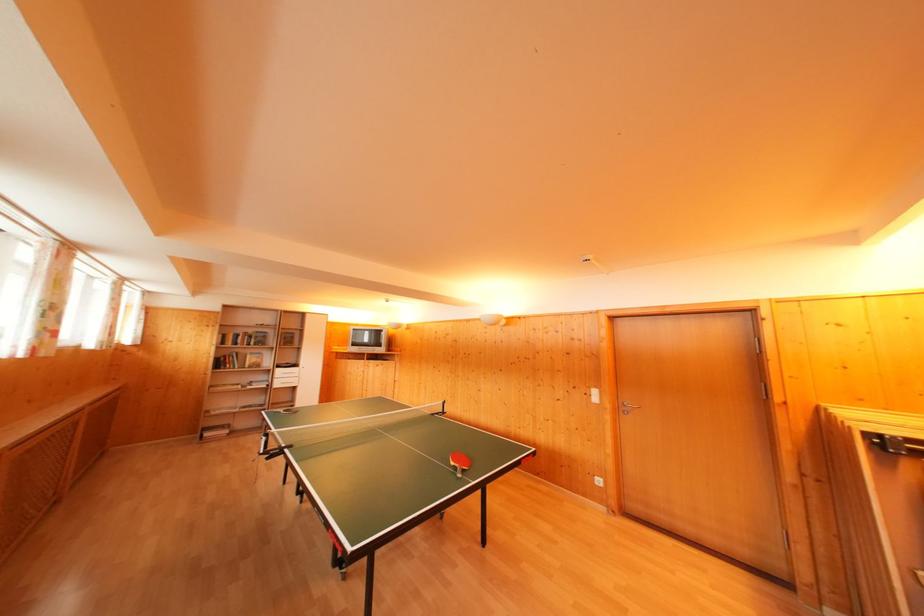
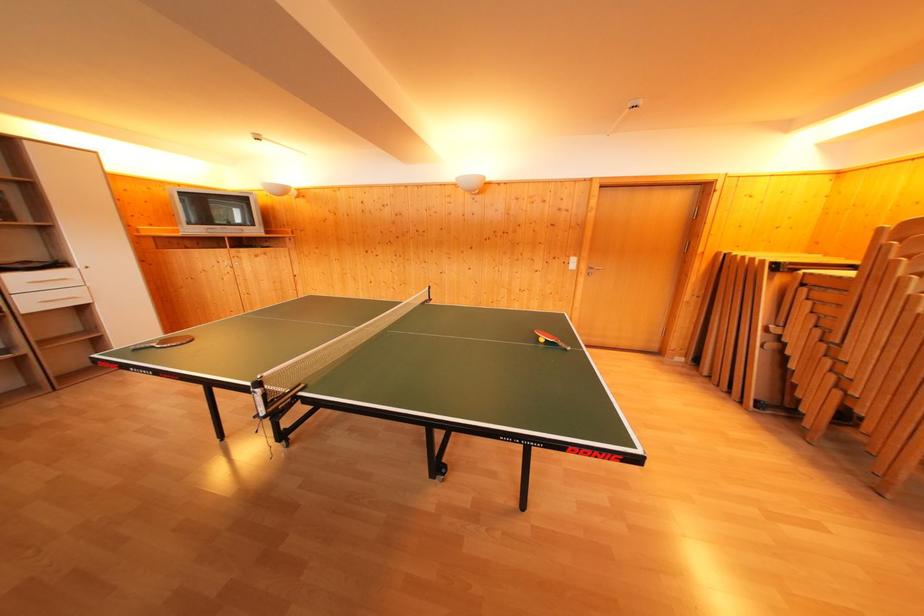
The point at (299, 371) is marked in the first image. Where is the corresponding point in the second image?

(64, 270)